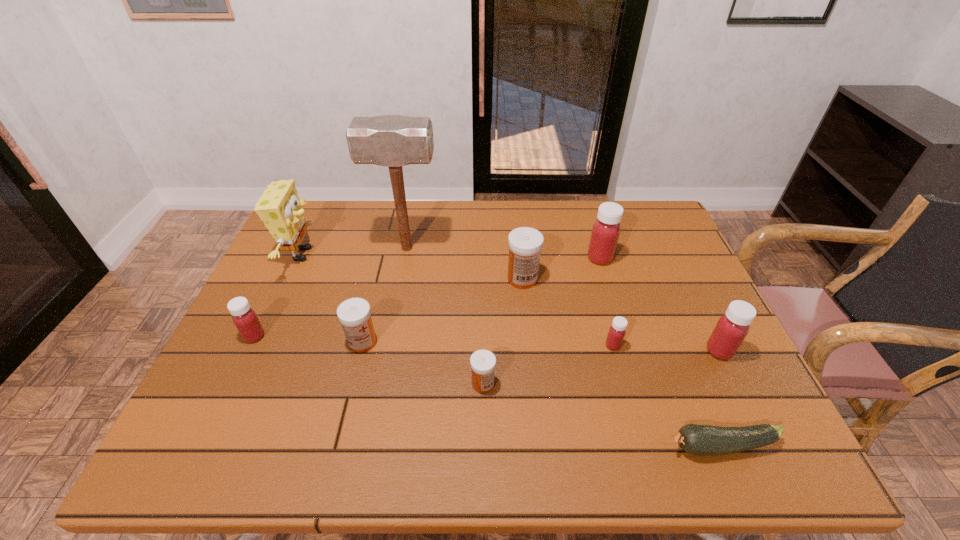
Find the location of `vacant space at the near edge of the desktop`. vacant space at the near edge of the desktop is located at coordinates (310, 453).

Where is `vacant space at the left edge of the desktop`? The width and height of the screenshot is (960, 540). vacant space at the left edge of the desktop is located at coordinates (286, 347).

You are a GUI agent. You are given a task and a screenshot of the screen. Output one action in this format:
    pyautogui.click(x=<x>, y=<y>)
    Task: Click on the vacant area at the right edge
    
    Given the screenshot: What is the action you would take?
    pyautogui.click(x=678, y=270)

You are a GUI agent. You are given a task and a screenshot of the screen. Output one action in this format:
    pyautogui.click(x=<x>, y=<y>)
    Task: Click on the vacant space at the far right corner
    
    Given the screenshot: What is the action you would take?
    pyautogui.click(x=657, y=230)

Identify the location of free space between the green zucchini and the second tallest object. This screenshot has height=540, width=960. (512, 350).

Locate an element on the screen. The height and width of the screenshot is (540, 960). free space between the second nearest object and the yellow sponge is located at coordinates (392, 319).

Find the location of a particular element. unoccupied position between the yellow sponge and the second smallest red medicine is located at coordinates (277, 295).

I want to click on empty space that is in between the second smallest red medicine and the farthest red medicine, so click(x=427, y=297).

Identify the location of free spot between the sixth nearest medicine and the smallest red medicine. (567, 312).

Locate an element on the screen. Image resolution: width=960 pixels, height=540 pixels. free spot between the smallest red medicine and the nearest object is located at coordinates (667, 396).